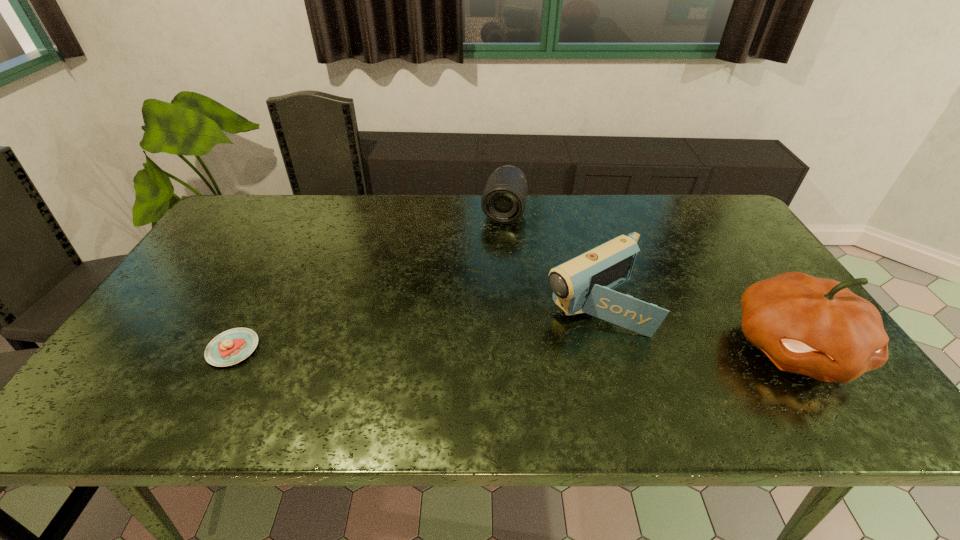
Where is `free space between the third object from right to left and the third object from left to right`? This screenshot has height=540, width=960. free space between the third object from right to left and the third object from left to right is located at coordinates (549, 257).

The image size is (960, 540). What are the coordinates of `vacant space in between the shortest object and the rightmost object` in the screenshot? It's located at (514, 348).

Locate an element on the screen. This screenshot has width=960, height=540. free space between the second object from right to left and the second shortest object is located at coordinates (549, 257).

At what (x,y) coordinates should I click in order to perform the action: click on vacant space that's between the third tallest object and the leftmost object. Please return your answer as a coordinate pair (x, y). The image size is (960, 540). Looking at the image, I should click on (369, 280).

Select which object appears as the third closest to the rightmost object. Please provide its 2D coordinates. Your answer should be formatted as a tuple, i.e. [(x, y)], where the tuple contains the x and y coordinates of a point satisfying the conditions above.

[(232, 346)]

Where is `object that can be found as the closest to the farthest object`? object that can be found as the closest to the farthest object is located at coordinates (585, 284).

I want to click on free space that satisfies the following two spatial constraints: 1. on the back side of the camcorder; 2. on the right side of the pastry, so click(257, 302).

You are a GUI agent. You are given a task and a screenshot of the screen. Output one action in this format:
    pyautogui.click(x=<x>, y=<y>)
    Task: Click on the free location that satisfies the following two spatial constraints: 1. on the back side of the leftmost object; 2. on the left side of the telephoto lens
    
    Given the screenshot: What is the action you would take?
    pyautogui.click(x=305, y=211)

Identify the location of vacant space that satisfies the following two spatial constraints: 1. on the back side of the third object from left to right; 2. on the right side of the shortest object. (257, 302).